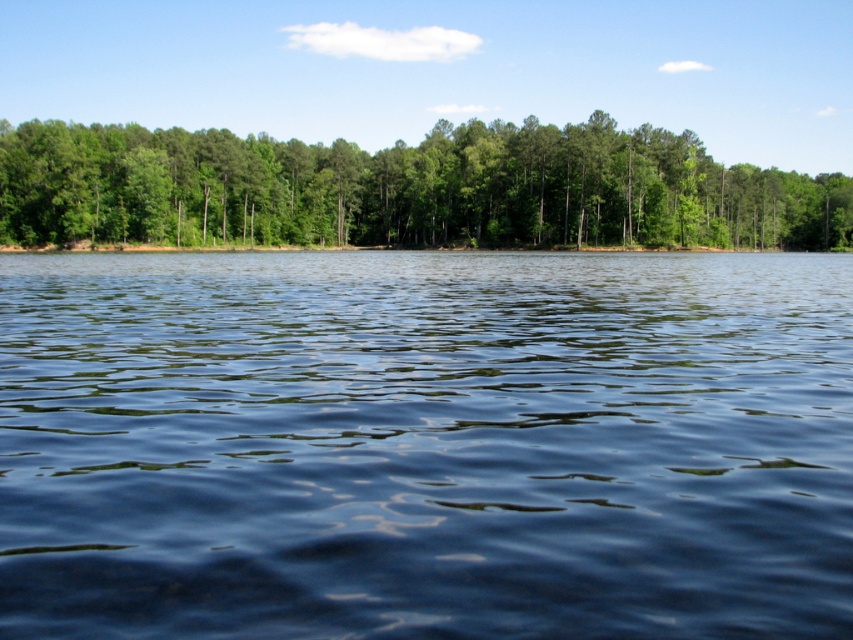
You are standing at the edge of the water in the scene. There is a point marked at coordinates point [242,502]. Can you reach this point without getting your feet wet?

The point [242,502] is 6.63 meters from the viewer, so yes, you can reach it without getting your feet wet since it is within the shoreline area described in the scene.

You are standing at the edge of the water and want to take a photo of the dark blue water at center and the green leafy trees at center. Based on their positions, which one would appear closer to you in the photo?

The dark blue water at center would appear closer to you in the photo because it is in front of the green leafy trees at center.

You are standing on a path near the water and want to take a photo that includes both the dark blue water at center and the green leafy trees at center. Which object should you adjust your camera angle to focus on first to ensure both are in the frame?

The dark blue water at center is smaller than the green leafy trees at center, so you should focus on the dark blue water at center first to ensure both fit in the frame.